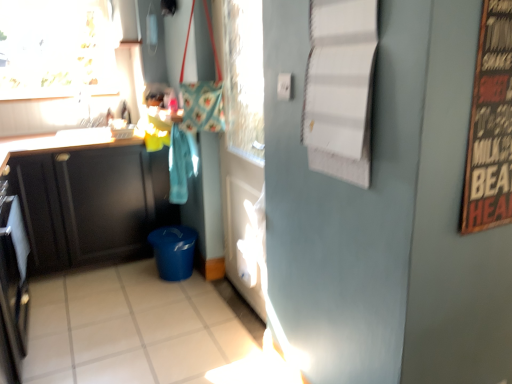
Question: Would you consider white glossy tile at lower center to be distant from black stainless steel oven at left?

Choices:
 (A) no
 (B) yes

Answer: (A)

Question: Can you confirm if white glossy tile at lower center is smaller than black stainless steel oven at left?

Choices:
 (A) yes
 (B) no

Answer: (B)

Question: Considering the relative positions of white glossy tile at lower center and black stainless steel oven at left in the image provided, is white glossy tile at lower center in front of black stainless steel oven at left?

Choices:
 (A) yes
 (B) no

Answer: (A)

Question: Considering the relative sizes of white glossy tile at lower center and black stainless steel oven at left in the image provided, is white glossy tile at lower center taller than black stainless steel oven at left?

Choices:
 (A) yes
 (B) no

Answer: (B)

Question: Is black stainless steel oven at left located within white glossy tile at lower center?

Choices:
 (A) yes
 (B) no

Answer: (B)

Question: Is white glossy tile at lower center turned away from black stainless steel oven at left?

Choices:
 (A) yes
 (B) no

Answer: (B)

Question: Is matte black cabinet at left, the second cabinetry viewed from the back, at the back of white glossy door at center?

Choices:
 (A) yes
 (B) no

Answer: (B)

Question: Is white glossy door at center to the right of matte black cabinet at left, the second cabinetry viewed from the back, from the viewer's perspective?

Choices:
 (A) no
 (B) yes

Answer: (B)

Question: Does white glossy door at center turn towards matte black cabinet at left, the first cabinetry from the front?

Choices:
 (A) yes
 (B) no

Answer: (A)

Question: From a real-world perspective, does white glossy door at center sit lower than matte black cabinet at left, the first cabinetry from the front?

Choices:
 (A) yes
 (B) no

Answer: (B)

Question: From the image's perspective, is white glossy door at center located above matte black cabinet at left, the first cabinetry from the front?

Choices:
 (A) no
 (B) yes

Answer: (B)

Question: Is white glossy door at center further to camera compared to matte black cabinet at left, the first cabinetry from the front?

Choices:
 (A) no
 (B) yes

Answer: (B)

Question: Considering the relative positions of wooden signboard at right and matte black cabinet at left, which appears as the 2th cabinetry when viewed from the front, in the image provided, is wooden signboard at right to the left of matte black cabinet at left, which appears as the 2th cabinetry when viewed from the front, from the viewer's perspective?

Choices:
 (A) no
 (B) yes

Answer: (A)